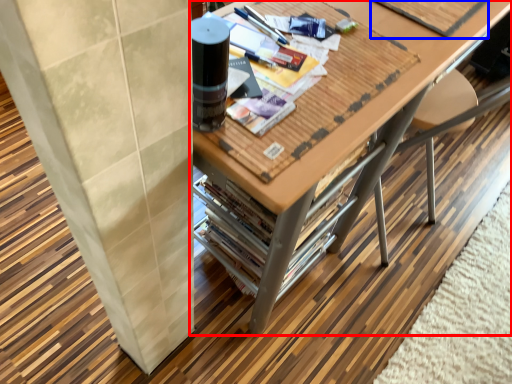
Question: Which object appears farthest to the camera in this image, table (highlighted by a red box) or magazine (highlighted by a blue box)?

Choices:
 (A) table
 (B) magazine

Answer: (B)